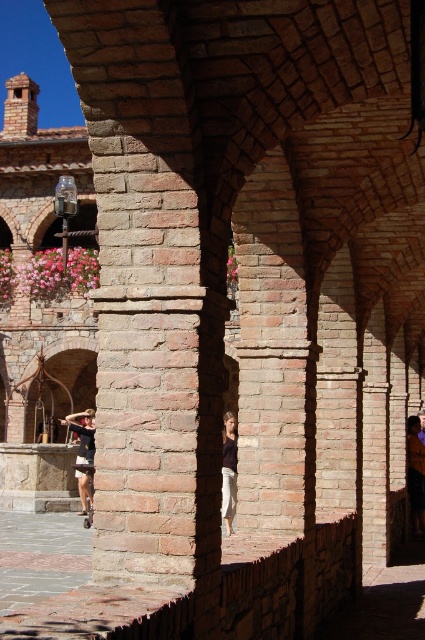
Is dark blue jeans at center shorter than dark brown leather jacket at lower left?

Yes, dark blue jeans at center is shorter than dark brown leather jacket at lower left.

The height and width of the screenshot is (640, 425). What do you see at coordinates (416, 474) in the screenshot? I see `dark blue jeans at center` at bounding box center [416, 474].

Identify the location of dark blue jeans at center. (416, 474).

Who is positioned more to the left, dark blue jeans at center or white cotton pants at center?

Positioned to the left is white cotton pants at center.

Is point (422, 461) behind point (235, 465)?

No, it is in front of (235, 465).

Find the location of a particular element. This screenshot has height=640, width=425. dark blue jeans at center is located at coordinates (416, 474).

Who is more distant from viewer, (48,403) or (85,512)?

The point (48,403) is behind.

Locate an element on the screen. brick archway at center is located at coordinates pos(57,387).